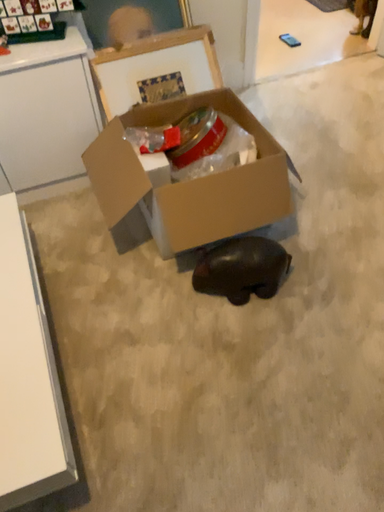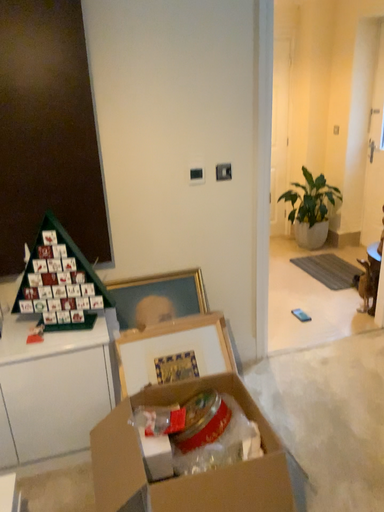
Question: Which way did the camera rotate in the video?

Choices:
 (A) rotated downward
 (B) rotated upward

Answer: (B)